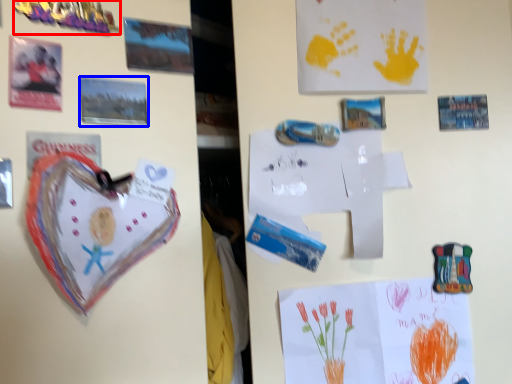
Question: Which object is further to the camera taking this photo, toy (highlighted by a red box) or postcard (highlighted by a blue box)?

Choices:
 (A) toy
 (B) postcard

Answer: (B)